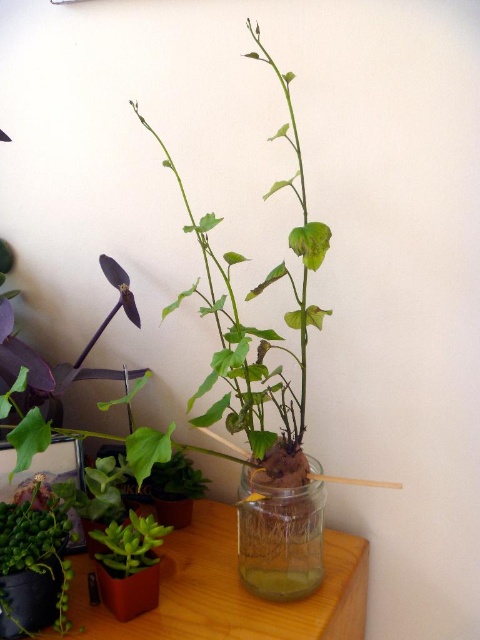
You are a plant enthusiast who wants to place a new 4.5 inch wide decorative item between the translucent glass jar at center and the green matte succulent at lower left. Can you fit it without overlapping either?

The distance between the translucent glass jar at center and the green matte succulent at lower left is 5.38 inches. Since the decorative item is 4.5 inches wide, it can fit between them as the space is larger than the item.

You have a small decorative item that is 10 cm wide. You want to place it on the wooden table at center without covering the green matte succulent at lower left. Is there enough space on the table?

The wooden table at center is wider than the green matte succulent at lower left, so there should be enough space to place the 10 cm wide decorative item without covering the succulent.

You are a gardener who wants to place a new plant pot that is 15 cm tall on the wooden table at center. Considering the height of the green matte plant at center, will the new plant pot be visible from above the table?

The wooden table at center has a lesser height compared to green matte plant at center. Since the new plant pot is 15 cm tall, it may not be visible from above the table if the green matte plant is taller than the table and the pot combined. However, without knowing the exact height of the plant, it is difficult to determine visibility.